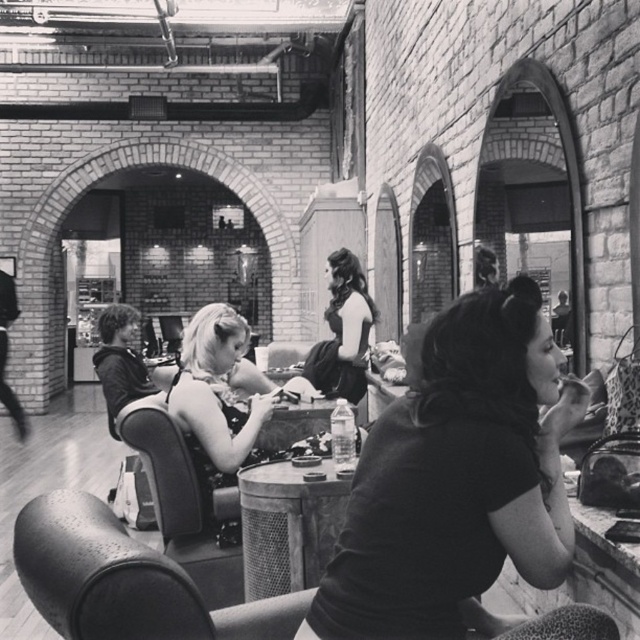
Question: Which point is closer to the camera?

Choices:
 (A) (x=356, y=259)
 (B) (x=280, y=486)
 (C) (x=216, y=454)
 (D) (x=406, y=403)

Answer: (D)

Question: Which is farther from the dark hair at center?

Choices:
 (A) matte black hair at center
 (B) matte black shirt at center

Answer: (B)

Question: Is matte black shirt at center wider than metal mesh table at center?

Choices:
 (A) yes
 (B) no

Answer: (A)

Question: Which point is closer to the camera?

Choices:
 (A) metal mesh table at center
 (B) matte black hair at center
 (C) dark hair at center

Answer: (A)

Question: Is matte black shirt at center positioned at the back of matte black hair at center?

Choices:
 (A) yes
 (B) no

Answer: (B)

Question: Does matte black shirt at center come behind matte black hair at center?

Choices:
 (A) yes
 (B) no

Answer: (B)